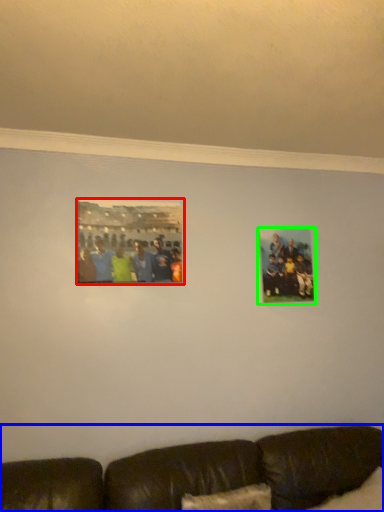
Question: Based on their relative distances, which object is farther from picture frame (highlighted by a red box)? Choose from studio couch (highlighted by a blue box) and picture frame (highlighted by a green box).

Choices:
 (A) studio couch
 (B) picture frame

Answer: (A)